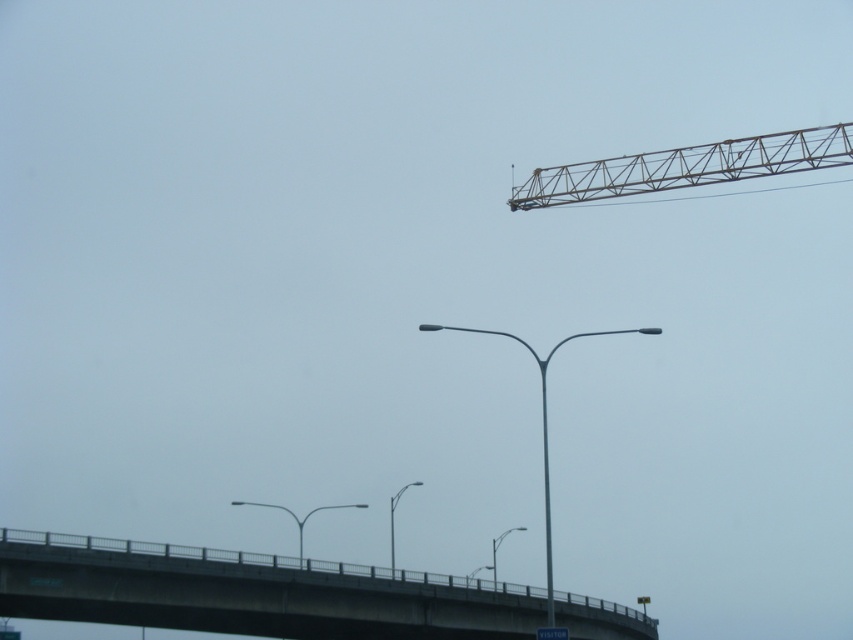
Question: In this image, where is concrete bridge at lower center located relative to metallic gray crane at upper right?

Choices:
 (A) right
 (B) left

Answer: (B)

Question: Is concrete bridge at lower center wider than metallic gray crane at upper right?

Choices:
 (A) no
 (B) yes

Answer: (B)

Question: Is concrete bridge at lower center to the left of metallic gray crane at upper right from the viewer's perspective?

Choices:
 (A) no
 (B) yes

Answer: (B)

Question: Which point is farther to the camera?

Choices:
 (A) (596, 163)
 (B) (288, 637)

Answer: (A)